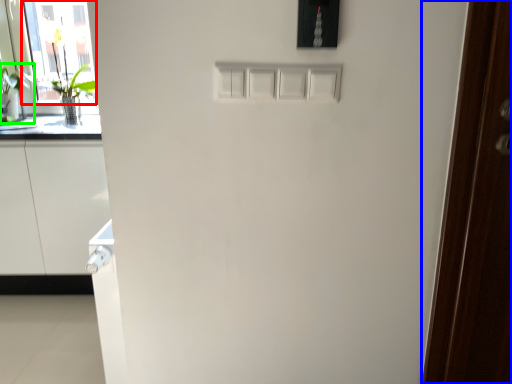
Question: Considering the real-world distances, which object is closest to glass door (highlighted by a red box)? door (highlighted by a blue box) or plant (highlighted by a green box).

Choices:
 (A) door
 (B) plant

Answer: (B)